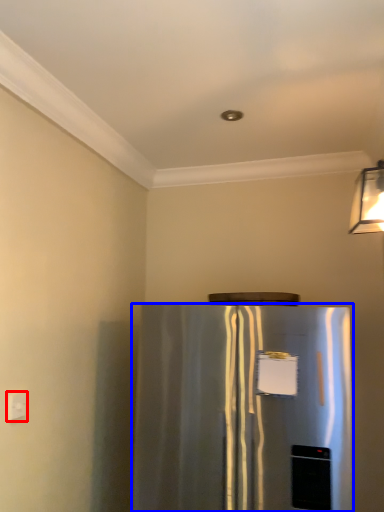
Question: Which of the following is the closest to the observer, electric outlet (highlighted by a red box) or refrigerator (highlighted by a blue box)?

Choices:
 (A) electric outlet
 (B) refrigerator

Answer: (B)